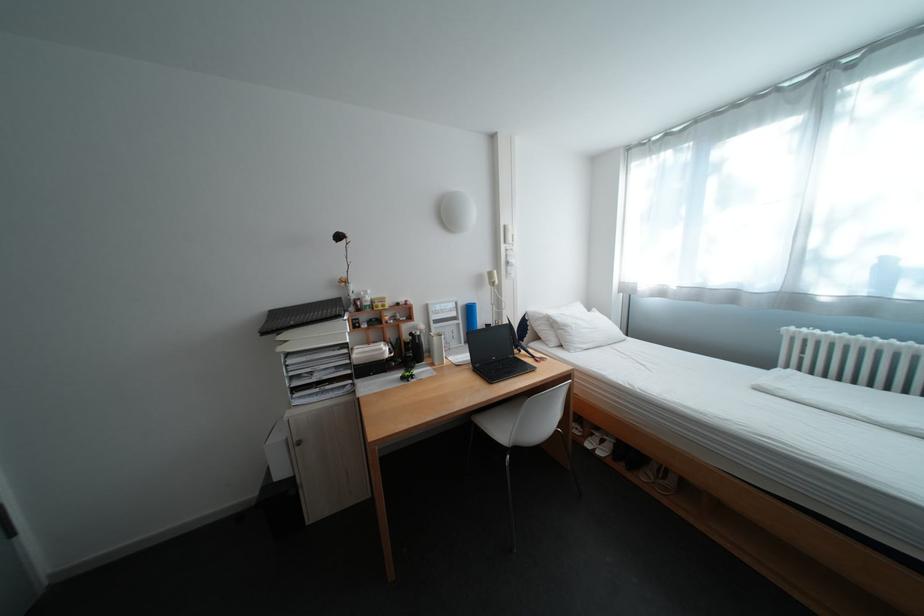
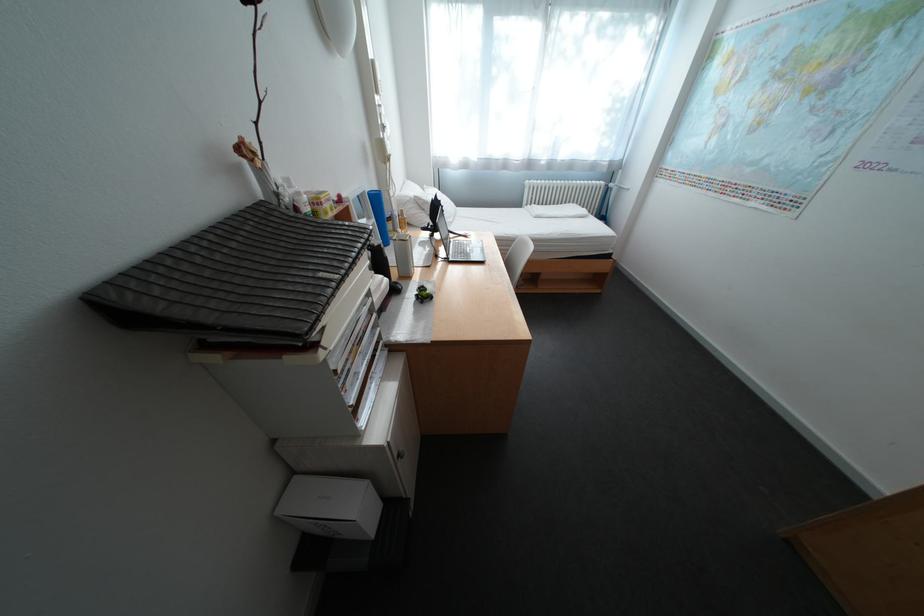
Find the pixel in the second image that matches [553,317] in the first image.

(420, 200)